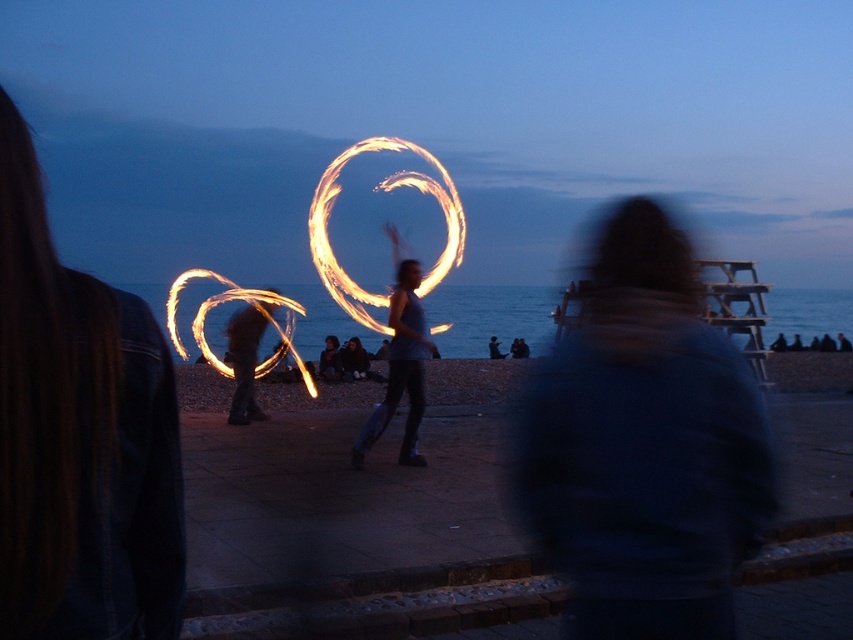
Is point (561, 483) closer to camera compared to point (340, 298)?

Yes.

Does dark blue fabric at center appear on the right side of fluorescent orange fire at center?

Yes, dark blue fabric at center is to the right of fluorescent orange fire at center.

Is point (602, 620) farther from camera compared to point (321, 224)?

That is False.

At what (x,y) coordinates should I click in order to perform the action: click on dark blue fabric at center. Please return your answer as a coordinate pair (x, y). Image resolution: width=853 pixels, height=640 pixels. Looking at the image, I should click on (645, 445).

Who is lower down, denim jacket at left or fluorescent orange fire at center?

denim jacket at left

The image size is (853, 640). Describe the element at coordinates (79, 436) in the screenshot. I see `denim jacket at left` at that location.

At what (x,y) coordinates should I click in order to perform the action: click on denim jacket at left. Please return your answer as a coordinate pair (x, y). The image size is (853, 640). Looking at the image, I should click on click(79, 436).

Between fluorescent orange fire at center and silvery metallic fire hoop at center, which one is positioned higher?

fluorescent orange fire at center is above.

Does point (403, 141) lie behind point (241, 410)?

Yes, point (403, 141) is behind point (241, 410).

Image resolution: width=853 pixels, height=640 pixels. Identify the location of fluorescent orange fire at center. (383, 189).